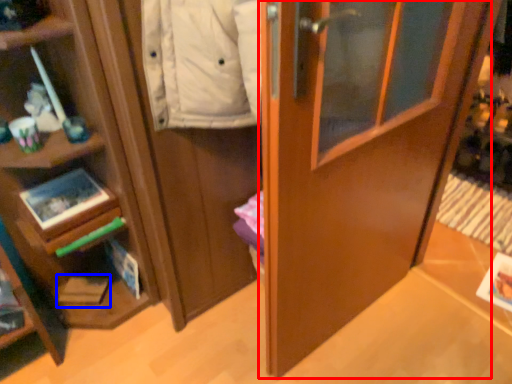
Question: Among these objects, which one is farthest to the camera, door (highlighted by a red box) or magazine (highlighted by a blue box)?

Choices:
 (A) door
 (B) magazine

Answer: (B)